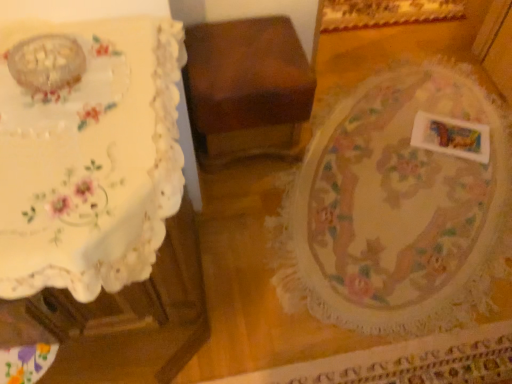
You are a GUI agent. You are given a task and a screenshot of the screen. Output one action in this format:
    pyautogui.click(x=<x>, y=<y>)
    Task: Click on the vacant area that is in front of white matte rectangular object at lower right
    The height and width of the screenshot is (384, 512).
    Given the screenshot: What is the action you would take?
    pyautogui.click(x=457, y=189)